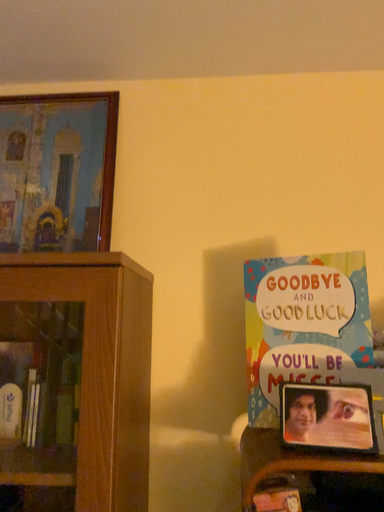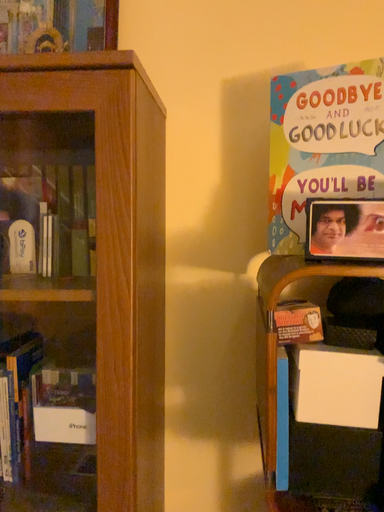
Question: Which way did the camera rotate in the video?

Choices:
 (A) rotated upward
 (B) rotated downward

Answer: (B)